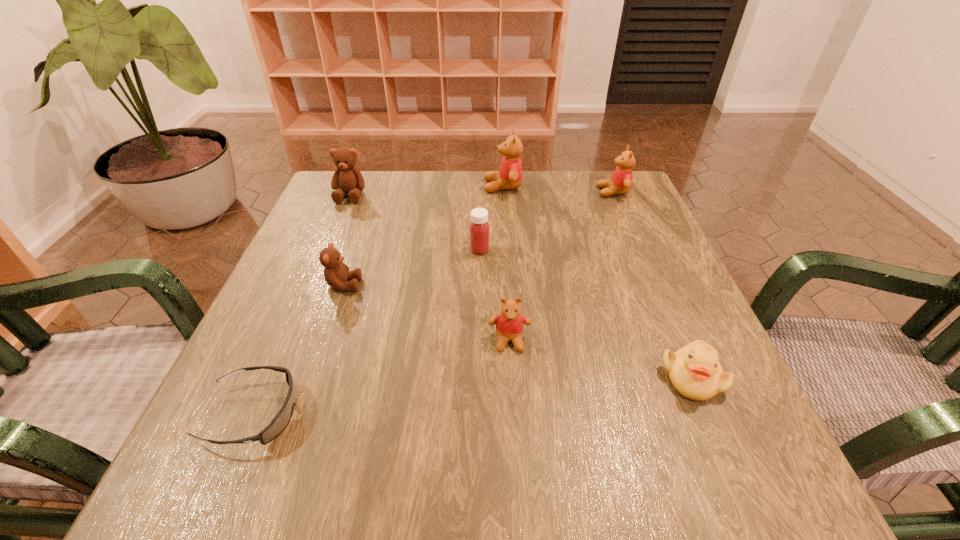
Find the location of a particular element. free space located 0.190m on the face of the bigger brown teddy bear is located at coordinates (326, 253).

Locate an element on the screen. vacant space positioned on the left of the red medicine is located at coordinates tap(322, 250).

Where is `vacant space situated 0.110m on the face of the fourth nearest object`? vacant space situated 0.110m on the face of the fourth nearest object is located at coordinates (417, 285).

The image size is (960, 540). I want to click on free spot located 0.230m on the front-facing side of the smallest red teddy bear, so point(519,495).

Locate an element on the screen. vacant space positioned on the lenses of the black goggles is located at coordinates pyautogui.click(x=352, y=414).

I want to click on object positioned at the near edge, so click(x=281, y=420).

Locate an element on the screen. This screenshot has height=540, width=960. goggles present at the left edge is located at coordinates (281, 420).

Where is `teddy bear that is at the right edge`? The height and width of the screenshot is (540, 960). teddy bear that is at the right edge is located at coordinates (621, 180).

The image size is (960, 540). Identify the location of duckling that is at the right edge. (694, 370).

Find the location of a particular element. object that is at the far left corner is located at coordinates (347, 178).